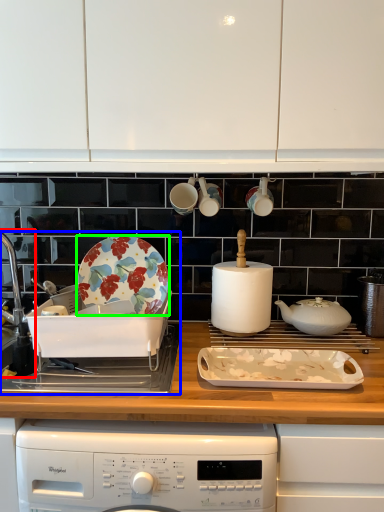
Question: Considering the real-world distances, which object is farthest from sink (highlighted by a red box)? sink (highlighted by a blue box) or plate (highlighted by a green box)?

Choices:
 (A) sink
 (B) plate

Answer: (B)